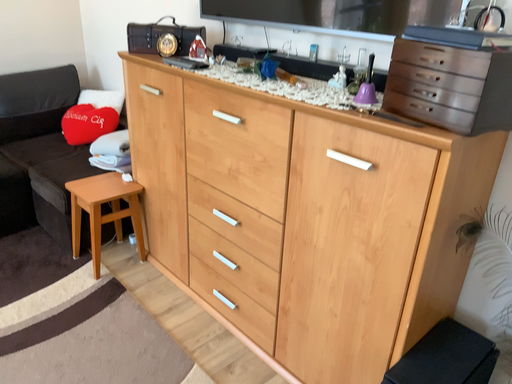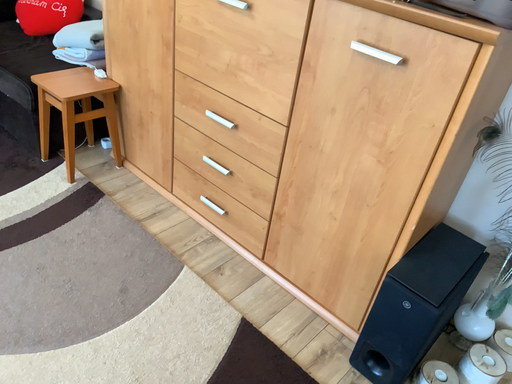
Question: How did the camera likely rotate when shooting the video?

Choices:
 (A) rotated downward
 (B) rotated upward

Answer: (A)